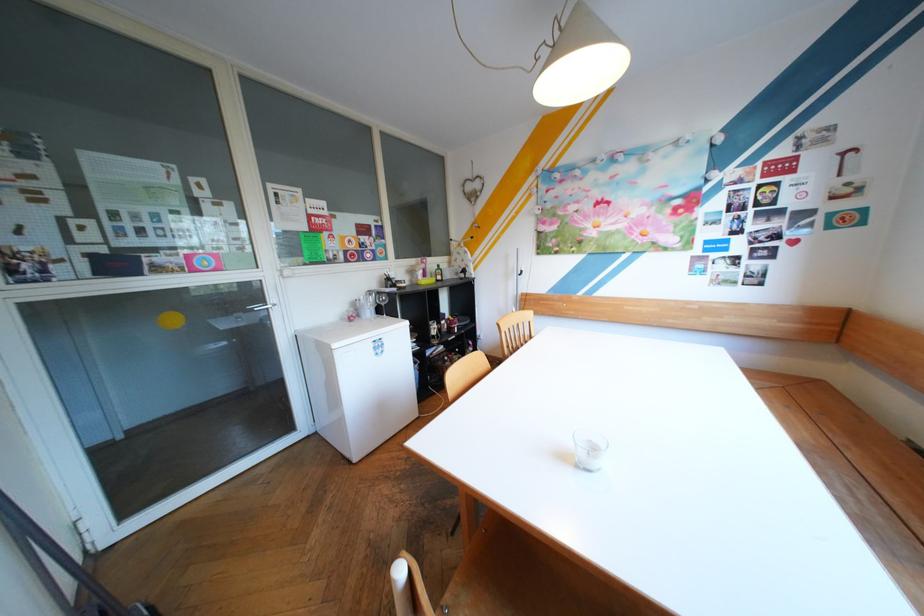
What do you see at coordinates (492, 588) in the screenshot? This screenshot has height=616, width=924. I see `the chair sitting surface` at bounding box center [492, 588].